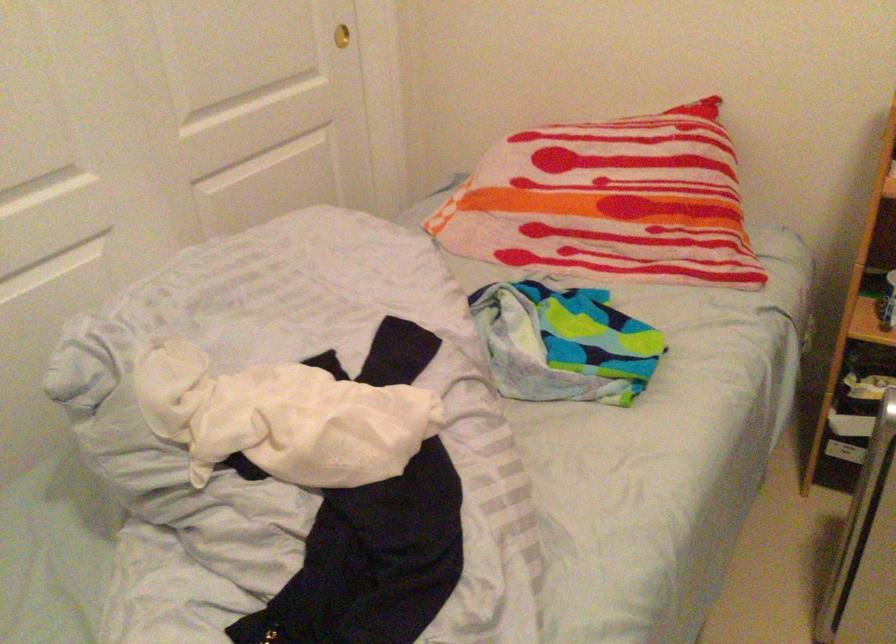
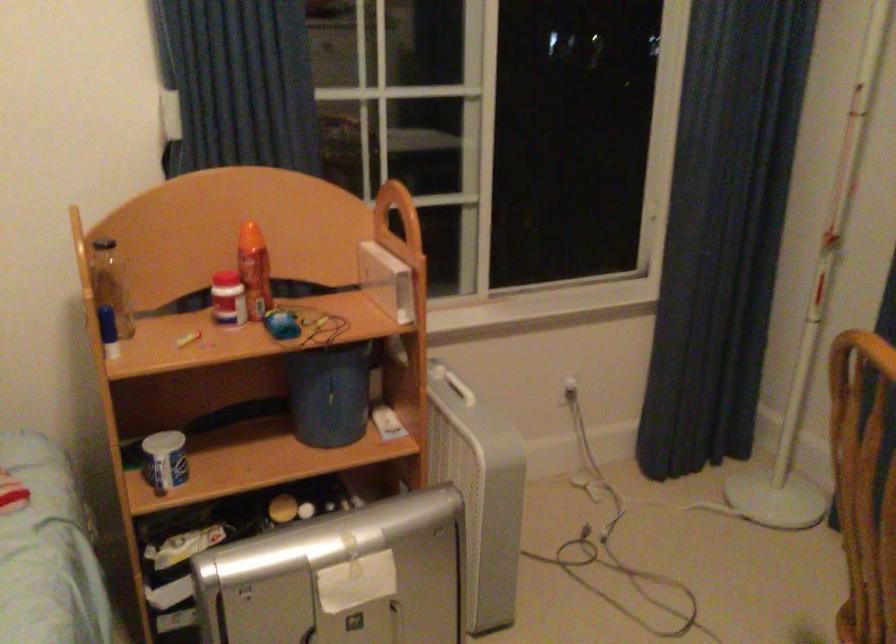
Question: The first image is from the beginning of the video and the second image is from the end. How did the camera likely rotate when shooting the video?

Choices:
 (A) Left
 (B) Right
 (C) Up
 (D) Down

Answer: (B)